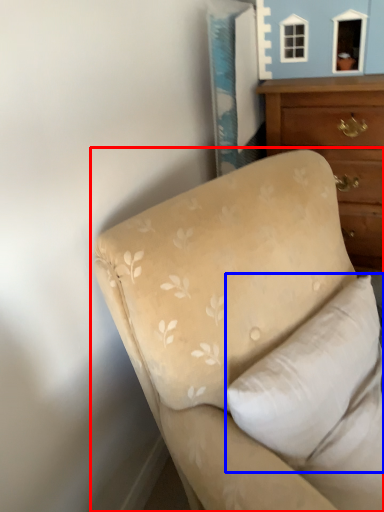
Question: Which point is further to the camera, studio couch (highlighted by a red box) or pillow (highlighted by a blue box)?

Choices:
 (A) studio couch
 (B) pillow

Answer: (B)